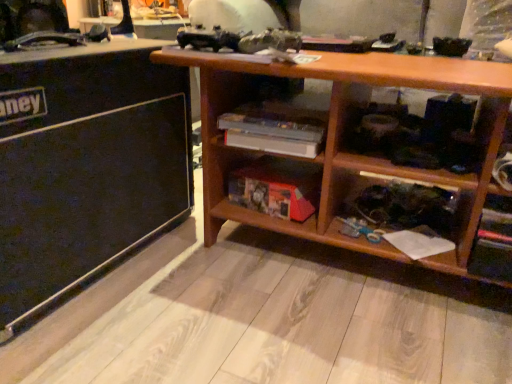
Measure the distance between wooden bookshelf at lower center and camera.

wooden bookshelf at lower center and camera are 1.09 meters apart from each other.

What is the approximate height of black matte speaker at left?

black matte speaker at left is 22.38 inches tall.

What do you see at coordinates (85, 164) in the screenshot? This screenshot has width=512, height=384. I see `black matte speaker at left` at bounding box center [85, 164].

In order to face wooden shelf at center, should I rotate leftwards or rightwards?

It's best to rotate right around 3.382 degrees.

The width and height of the screenshot is (512, 384). Identify the location of wooden bookshelf at lower center. (276, 187).

How many degrees apart are the facing directions of wooden bookshelf at lower center and wooden shelf at center?

The facing directions of wooden bookshelf at lower center and wooden shelf at center are 0.00114 degrees apart.

Which object is further away from the camera, wooden bookshelf at lower center or wooden shelf at center?

wooden bookshelf at lower center.

In terms of width, does wooden bookshelf at lower center look wider or thinner when compared to wooden shelf at center?

Clearly, wooden bookshelf at lower center has less width compared to wooden shelf at center.

Are wooden bookshelf at lower center and wooden shelf at center far apart?

wooden bookshelf at lower center is actually quite close to wooden shelf at center.

Can you confirm if wooden shelf at center is smaller than wooden bookshelf at lower center?

No, wooden shelf at center is not smaller than wooden bookshelf at lower center.

Is wooden shelf at center behind wooden bookshelf at lower center?

No, wooden shelf at center is in front of wooden bookshelf at lower center.

Can you see wooden shelf at center touching wooden bookshelf at lower center?

No, wooden shelf at center is not in contact with wooden bookshelf at lower center.

Is wooden shelf at center aimed at wooden bookshelf at lower center?

No, wooden shelf at center does not turn towards wooden bookshelf at lower center.

Does wooden shelf at center have a greater width compared to black matte speaker at left?

No.

Which is behind, wooden shelf at center or black matte speaker at left?

wooden shelf at center is behind.

Do you think wooden shelf at center is within black matte speaker at left, or outside of it?

wooden shelf at center lies outside black matte speaker at left.

From a real-world perspective, which is physically above, wooden shelf at center or black matte speaker at left?

From a 3D spatial view, wooden shelf at center is above.

Consider the image. Could you tell me if wooden bookshelf at lower center is turned towards black matte speaker at left?

No, wooden bookshelf at lower center does not turn towards black matte speaker at left.

From the image's perspective, relative to black matte speaker at left, is wooden bookshelf at lower center above or below?

wooden bookshelf at lower center is below black matte speaker at left.

In the scene shown: Can you confirm if wooden bookshelf at lower center is positioned to the right of black matte speaker at left?

Correct, you'll find wooden bookshelf at lower center to the right of black matte speaker at left.

Can you see black matte speaker at left touching wooden shelf at center?

There is a gap between black matte speaker at left and wooden shelf at center.

Between black matte speaker at left and wooden shelf at center, which one is positioned behind?

wooden shelf at center is behind.

Between black matte speaker at left and wooden shelf at center, which one has larger width?

Wider between the two is black matte speaker at left.

Which of these two, black matte speaker at left or wooden shelf at center, is bigger?

Bigger between the two is black matte speaker at left.

Does point (118, 56) come farther from viewer compared to point (263, 174)?

No.

Who is taller, black matte speaker at left or wooden bookshelf at lower center?

black matte speaker at left.

Does black matte speaker at left touch wooden bookshelf at lower center?

There is a gap between black matte speaker at left and wooden bookshelf at lower center.

Can you tell me how much black matte speaker at left and wooden bookshelf at lower center differ in facing direction?

The facing directions of black matte speaker at left and wooden bookshelf at lower center are 89 degrees apart.

The image size is (512, 384). I want to click on shelf located underneath the wooden shelf at center (from a real-world perspective), so click(276, 187).

I want to click on cabinet lying on the right of wooden bookshelf at lower center, so click(261, 120).

Considering their positions, is black matte speaker at left positioned closer to wooden bookshelf at lower center than wooden shelf at center?

The object closer to wooden bookshelf at lower center is wooden shelf at center.

Which object lies nearer to the anchor point wooden bookshelf at lower center, wooden shelf at center or black matte speaker at left?

The object closer to wooden bookshelf at lower center is wooden shelf at center.

From the image, which object appears to be nearer to black matte speaker at left, wooden bookshelf at lower center or wooden shelf at center?

wooden shelf at center lies closer to black matte speaker at left than the other object.

From the image, which object appears to be farther from wooden shelf at center, wooden bookshelf at lower center or black matte speaker at left?

Based on the image, black matte speaker at left appears to be further to wooden shelf at center.

When comparing their distances from black matte speaker at left, does wooden shelf at center or wooden bookshelf at lower center seem further?

wooden bookshelf at lower center is positioned further to the anchor black matte speaker at left.

Looking at this image, which object lies further to the anchor point wooden shelf at center, black matte speaker at left or wooden bookshelf at lower center?

Based on the image, black matte speaker at left appears to be further to wooden shelf at center.

The width and height of the screenshot is (512, 384). In order to click on shelf located between black matte speaker at left and wooden shelf at center in the left-right direction in this screenshot , I will do `click(276, 187)`.